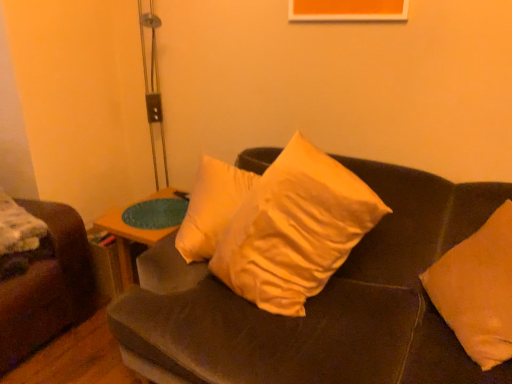
Question: Would you say metallic silver table lamp at upper left is part of orange fabric pillow at right, positioned as the second pillow in left-to-right order,'s contents?

Choices:
 (A) yes
 (B) no

Answer: (B)

Question: Is orange fabric pillow at right, positioned as the second pillow in left-to-right order, further to the viewer compared to metallic silver table lamp at upper left?

Choices:
 (A) yes
 (B) no

Answer: (B)

Question: From a real-world perspective, is orange fabric pillow at right, which is the 1th pillow from right to left, on metallic silver table lamp at upper left?

Choices:
 (A) yes
 (B) no

Answer: (B)

Question: Can you confirm if orange fabric pillow at right, which is the 1th pillow from right to left, is bigger than metallic silver table lamp at upper left?

Choices:
 (A) yes
 (B) no

Answer: (B)

Question: Is orange fabric pillow at right, which is the 1th pillow from right to left, not close to metallic silver table lamp at upper left?

Choices:
 (A) yes
 (B) no

Answer: (A)

Question: Is the surface of orange fabric pillow at right, which is the 1th pillow from right to left, in direct contact with metallic silver table lamp at upper left?

Choices:
 (A) yes
 (B) no

Answer: (B)

Question: From a real-world perspective, does soft yellow pillow at center, the first pillow viewed from the left, stand above metallic silver table lamp at upper left?

Choices:
 (A) no
 (B) yes

Answer: (A)

Question: Is soft yellow pillow at center, the first pillow viewed from the left, closer to the viewer compared to metallic silver table lamp at upper left?

Choices:
 (A) no
 (B) yes

Answer: (B)

Question: Is soft yellow pillow at center, placed as the 2th pillow when sorted from right to left, not near metallic silver table lamp at upper left?

Choices:
 (A) no
 (B) yes

Answer: (B)

Question: Considering the relative sizes of soft yellow pillow at center, placed as the 2th pillow when sorted from right to left, and metallic silver table lamp at upper left in the image provided, is soft yellow pillow at center, placed as the 2th pillow when sorted from right to left, smaller than metallic silver table lamp at upper left?

Choices:
 (A) yes
 (B) no

Answer: (B)

Question: Considering the relative sizes of soft yellow pillow at center, the first pillow viewed from the left, and metallic silver table lamp at upper left in the image provided, is soft yellow pillow at center, the first pillow viewed from the left, bigger than metallic silver table lamp at upper left?

Choices:
 (A) yes
 (B) no

Answer: (A)

Question: Is the surface of soft yellow pillow at center, placed as the 2th pillow when sorted from right to left, in direct contact with metallic silver table lamp at upper left?

Choices:
 (A) no
 (B) yes

Answer: (A)

Question: Can you confirm if woodenwoodentable at center is shorter than orange fabric pillow at right, positioned as the second pillow in left-to-right order?

Choices:
 (A) yes
 (B) no

Answer: (A)